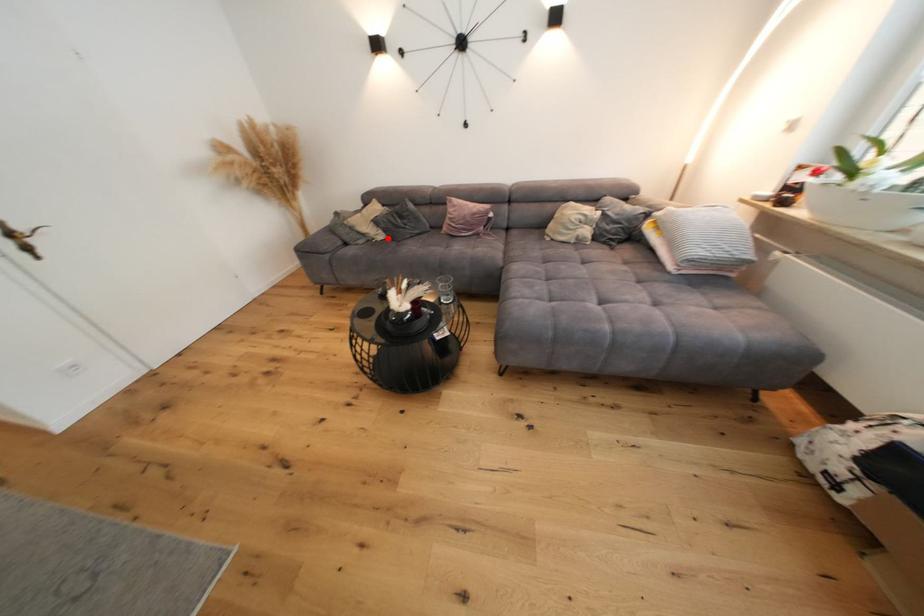
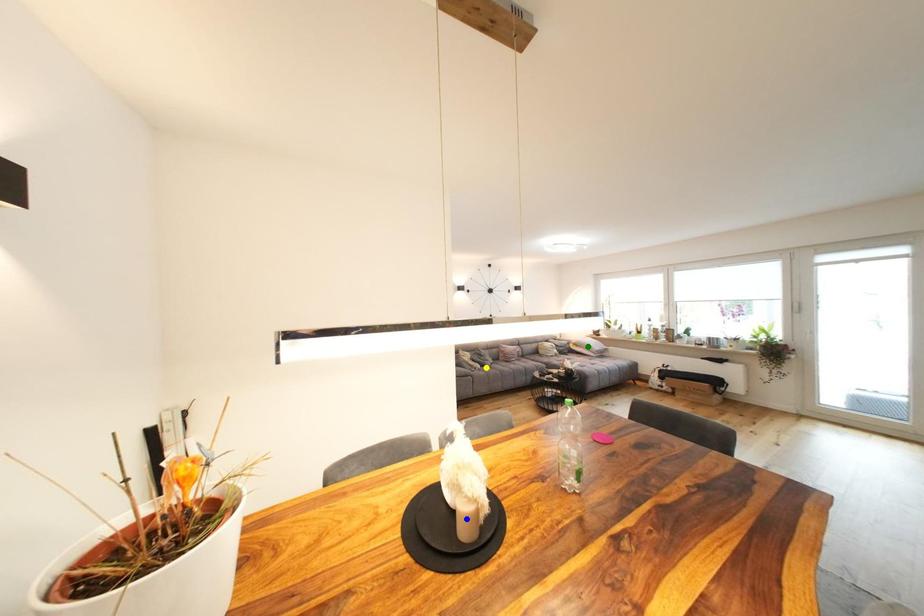
Question: I am providing you with two images of the same scene from different viewpoints. A red point is marked on the first image. You are given multiple points on the second image. Which point in image 2 is actually the same real-world point as the red point in image 1?

Choices:
 (A) yellow point
 (B) green point
 (C) blue point

Answer: (A)